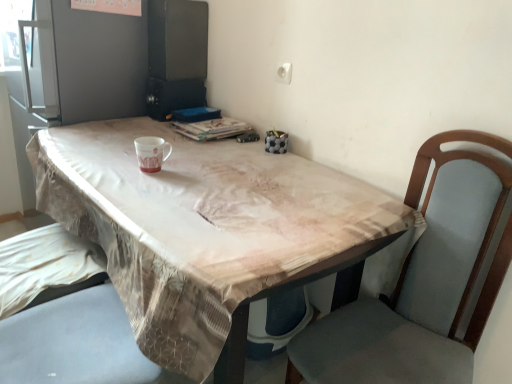
The height and width of the screenshot is (384, 512). I want to click on vacant region to the left of matte ceramic mug at center, so click(x=103, y=170).